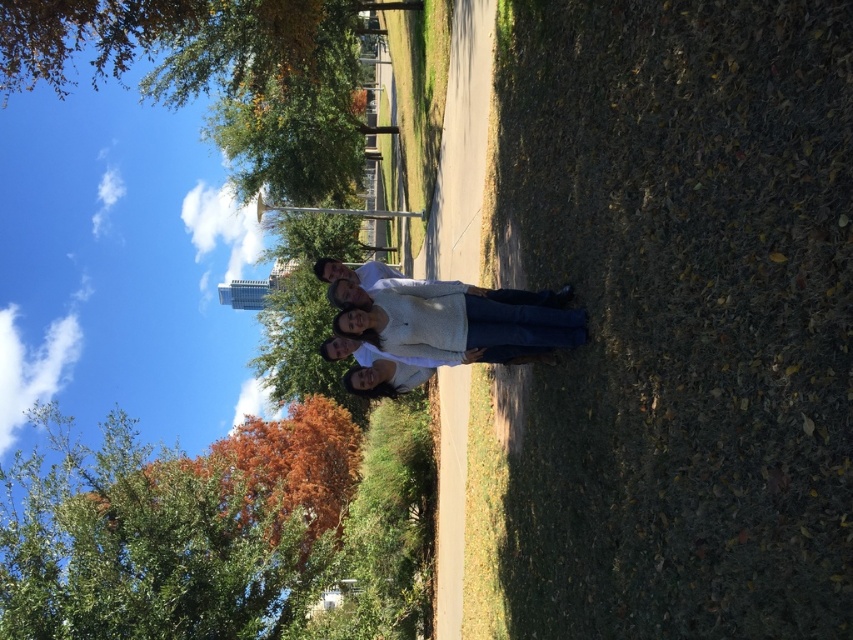
Question: Considering the relative positions of green leafy tree at center and white matte sweater at center in the image provided, where is green leafy tree at center located with respect to white matte sweater at center?

Choices:
 (A) left
 (B) right

Answer: (A)

Question: Which of the following is the closest to the observer?

Choices:
 (A) (492, 326)
 (B) (401, 634)
 (C) (335, 285)

Answer: (A)

Question: Which object is farther from the camera taking this photo?

Choices:
 (A) white matte sweater at center
 (B) white matte jacket at center
 (C) green leafy tree at center

Answer: (C)

Question: Is green leafy tree at center to the left of white matte jacket at center from the viewer's perspective?

Choices:
 (A) no
 (B) yes

Answer: (B)

Question: Which object is the farthest from the white matte sweater at center?

Choices:
 (A) green leafy tree at center
 (B) white matte jacket at center

Answer: (A)

Question: Is green leafy tree at center positioned at the back of white matte sweater at center?

Choices:
 (A) yes
 (B) no

Answer: (A)